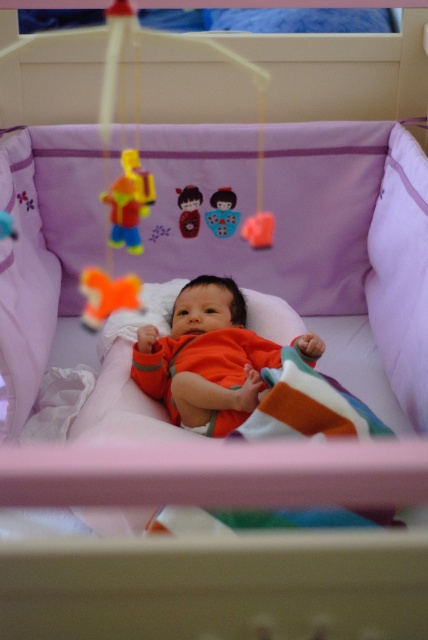
Question: Is purple soft pillow at upper center wider than matte plastic doll at upper center?

Choices:
 (A) no
 (B) yes

Answer: (B)

Question: Estimate the real-world distances between objects in this image. Which object is closer to the orange plush toy at center?

Choices:
 (A) yellow plastic toy at upper center
 (B) white soft pillow at center

Answer: (A)

Question: Does purple soft pillow at right appear over orange plush toy at center?

Choices:
 (A) yes
 (B) no

Answer: (A)

Question: Does white soft pillow at center appear over purple soft pillow at right?

Choices:
 (A) no
 (B) yes

Answer: (B)

Question: Considering the real-world distances, which object is closest to the yellow plastic toy at upper center?

Choices:
 (A) matte plastic doll at center
 (B) purple soft pillow at right
 (C) matte plastic doll at upper center

Answer: (C)

Question: Considering the real-world distances, which object is closest to the yellow plastic toy at upper center?

Choices:
 (A) orange soft fabric baby at center
 (B) orange plush toy at center

Answer: (B)